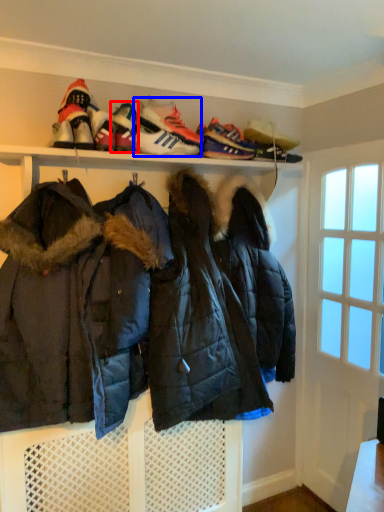
Question: Which point is closer to the camera, footwear (highlighted by a red box) or footwear (highlighted by a blue box)?

Choices:
 (A) footwear
 (B) footwear

Answer: (A)